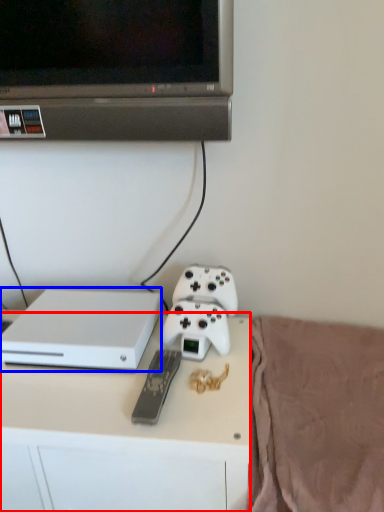
Question: Among these objects, which one is farthest to the camera, desk (highlighted by a red box) or computer (highlighted by a blue box)?

Choices:
 (A) desk
 (B) computer

Answer: (B)